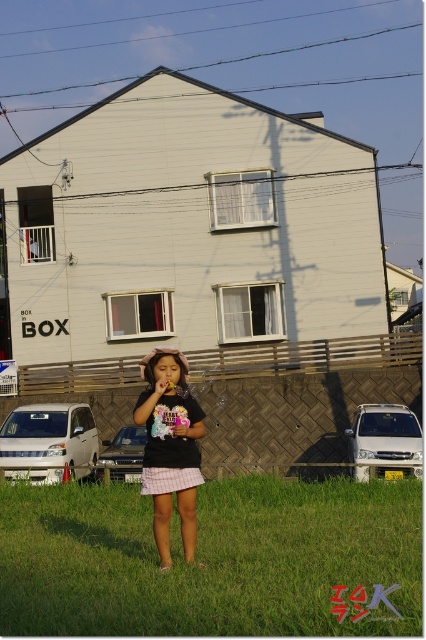
Question: Can you confirm if plaid cotton dress at center is bigger than matte pink flower at center?

Choices:
 (A) no
 (B) yes

Answer: (B)

Question: Which point appears farthest from the camera in this image?

Choices:
 (A) (169, 515)
 (B) (377, 500)
 (C) (150, 417)
 (D) (173, 422)

Answer: (B)

Question: Does green grass at center appear under matte black shirt at center?

Choices:
 (A) no
 (B) yes

Answer: (B)

Question: Which point appears farthest from the camera in this image?

Choices:
 (A) (241, 483)
 (B) (184, 410)

Answer: (A)

Question: Is green grass at center thinner than matte pink flower at center?

Choices:
 (A) yes
 (B) no

Answer: (B)

Question: Which object is positioned closest to the matte black shirt at center?

Choices:
 (A) matte pink flower at center
 (B) plaid cotton dress at center
 (C) green grass at center

Answer: (A)